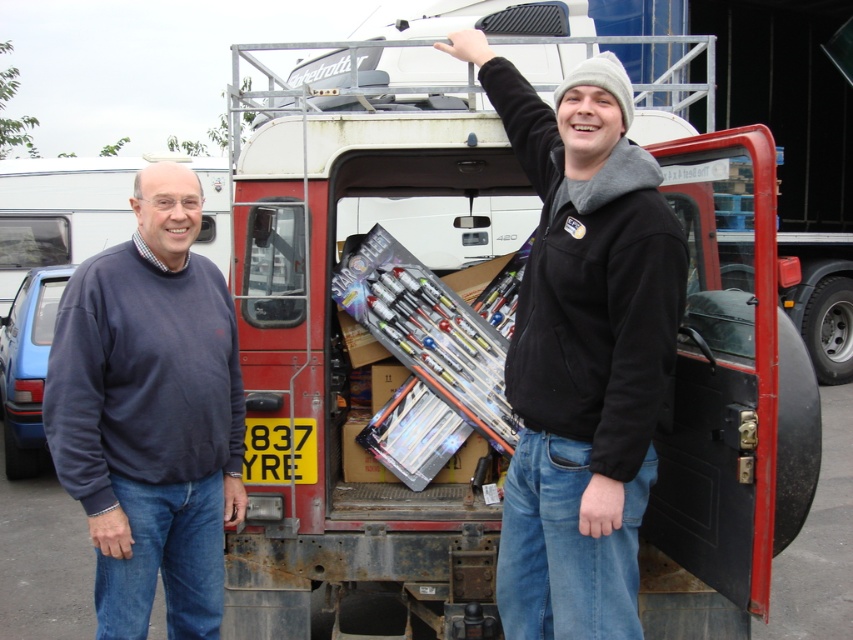
Where is `metallic silver toolbox at upper center`? The image size is (853, 640). metallic silver toolbox at upper center is located at coordinates (582, 349).

Does metallic silver toolbox at upper center lie in front of dark blue sweater at left?

Yes.

Who is more forward, (503, 580) or (167, 403)?

Point (167, 403)

The width and height of the screenshot is (853, 640). Find the location of `metallic silver toolbox at upper center`. metallic silver toolbox at upper center is located at coordinates (582, 349).

Does metallic trailer truck at center have a lesser width compared to dark blue sweater at left?

In fact, metallic trailer truck at center might be wider than dark blue sweater at left.

Who is positioned more to the right, metallic trailer truck at center or dark blue sweater at left?

From the viewer's perspective, metallic trailer truck at center appears more on the right side.

Is point (664, 433) closer to viewer compared to point (68, 384)?

That is False.

Identify the location of metallic trailer truck at center. The height and width of the screenshot is (640, 853). (344, 358).

Can you confirm if metallic trailer truck at center is bigger than metallic silver toolbox at upper center?

Yes, metallic trailer truck at center is bigger than metallic silver toolbox at upper center.

Who is positioned more to the left, metallic trailer truck at center or metallic silver toolbox at upper center?

From the viewer's perspective, metallic trailer truck at center appears more on the left side.

The width and height of the screenshot is (853, 640). What are the coordinates of `metallic trailer truck at center` in the screenshot? It's located at (344, 358).

Identify the location of metallic trailer truck at center. (344, 358).